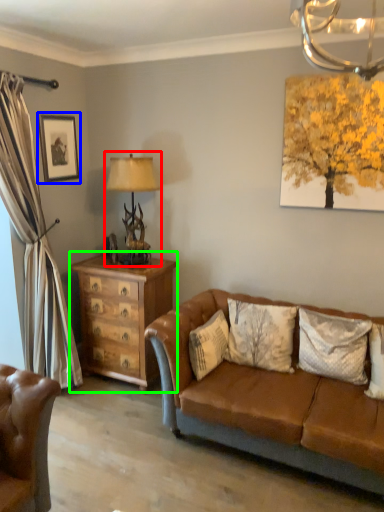
Question: Which object is the farthest from table lamp (highlighted by a red box)? Choose among these: picture frame (highlighted by a blue box) or chest of drawers (highlighted by a green box).

Choices:
 (A) picture frame
 (B) chest of drawers

Answer: (A)